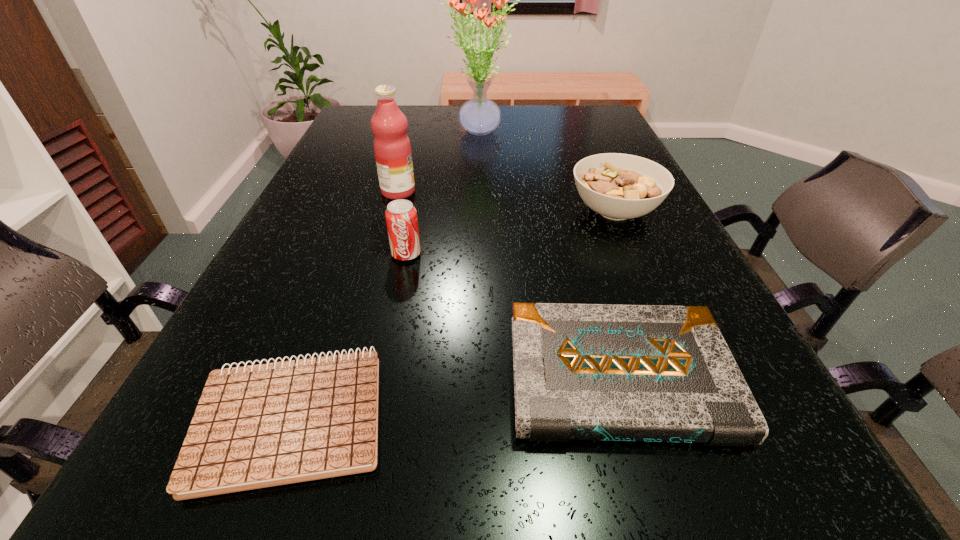
The image size is (960, 540). Find the location of `the farthest object`. the farthest object is located at coordinates (479, 116).

Identify the location of the tallest object. (479, 116).

The width and height of the screenshot is (960, 540). I want to click on the second tallest object, so click(x=392, y=148).

This screenshot has height=540, width=960. Identify the location of the fourth farthest object. (401, 216).

Locate an element on the screen. This screenshot has height=540, width=960. the third tallest object is located at coordinates (401, 216).

Where is `stew`? stew is located at coordinates (618, 186).

Where is `the taller notebook`? This screenshot has width=960, height=540. the taller notebook is located at coordinates (648, 373).

This screenshot has height=540, width=960. I want to click on the fifth tallest object, so click(648, 373).

This screenshot has height=540, width=960. In order to click on the shorter notebook in this screenshot , I will do `click(256, 426)`.

Find the location of a particular element. Image resolution: width=960 pixels, height=540 pixels. the left notebook is located at coordinates (256, 426).